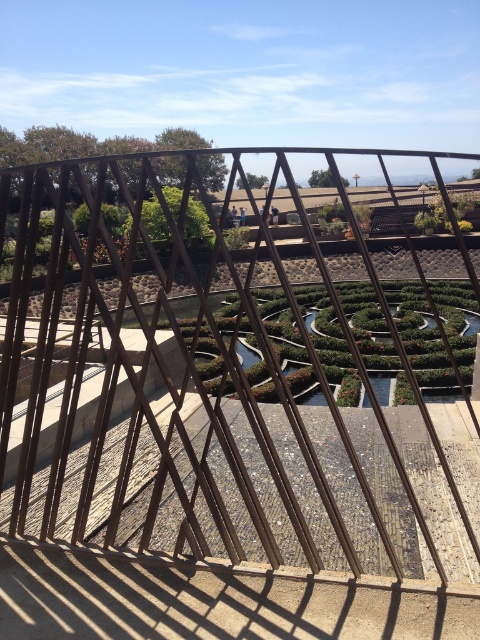
You are standing on a balcony and want to know if the metallic wire fence at center is wider than the green leafy hedge at center. Can you determine this based on the view?

The metallic wire fence at center is wider than the green leafy hedge at center according to the description.

You are standing on the balcony and looking down at the garden. You see the metallic wire fence at center and the green leafy hedge at center. Which object is positioned more to the left side from your viewpoint?

The metallic wire fence at center is positioned to the left of the green leafy hedge at center, so it is more to the left side from your viewpoint.